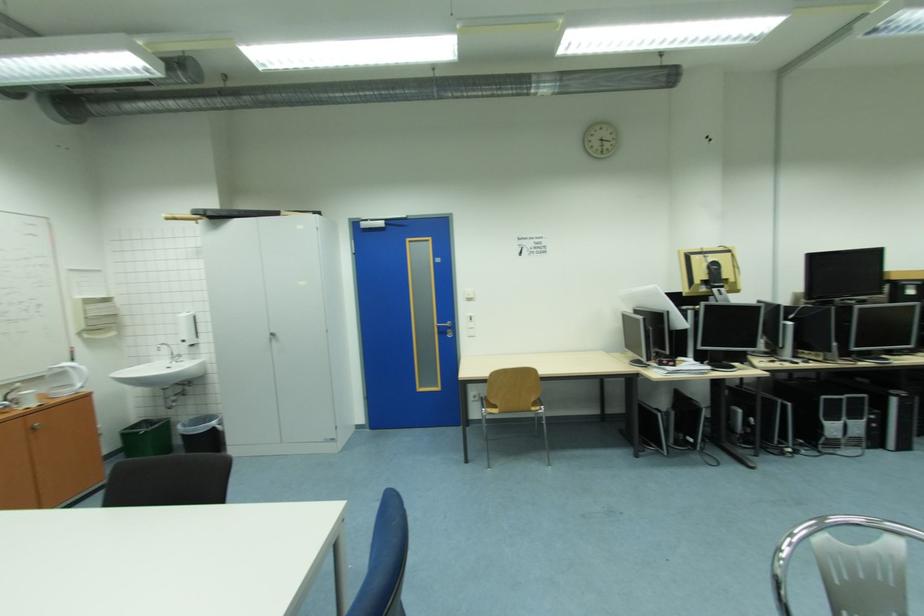
Where would you lift the green trash can? Please return your answer as a coordinate pair (x, y).

(147, 438)